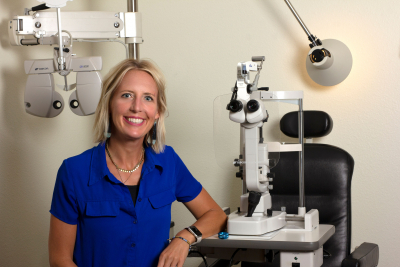
This screenshot has width=400, height=267. In order to click on black headrest in this screenshot , I will do `click(309, 123)`.